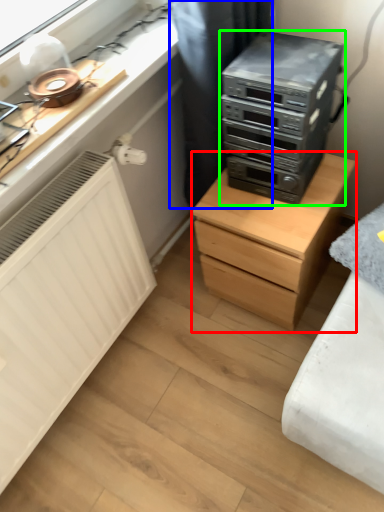
Question: Considering the real-world distances, which object is farthest from chest of drawers (highlighted by a red box)? curtain (highlighted by a blue box) or home appliance (highlighted by a green box)?

Choices:
 (A) curtain
 (B) home appliance

Answer: (A)